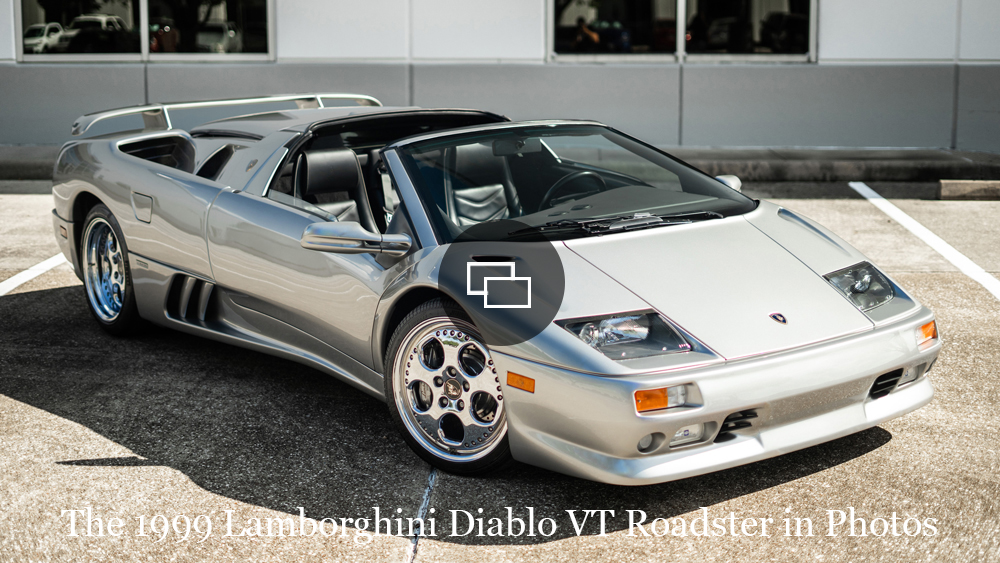
Find the location of a particular element. The height and width of the screenshot is (563, 1000). light is located at coordinates (926, 337).